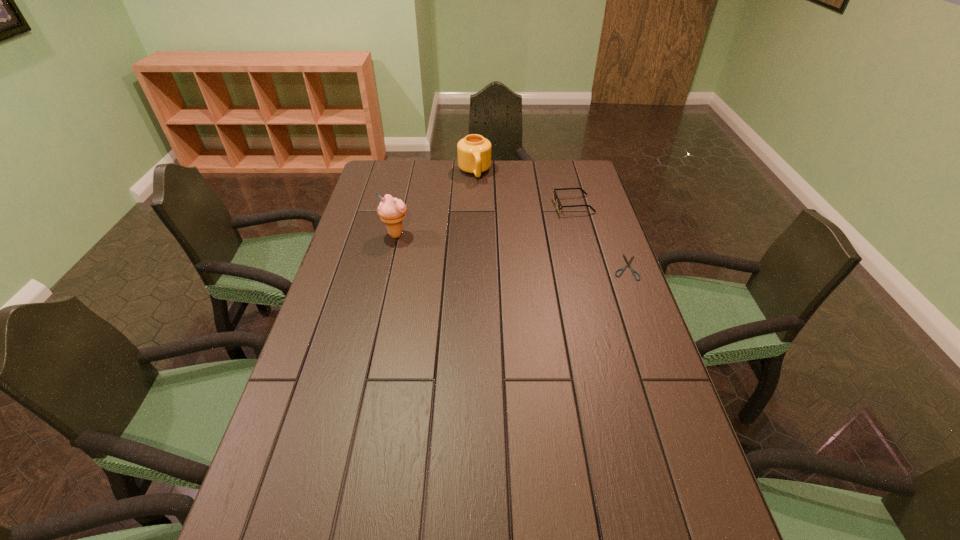
This screenshot has width=960, height=540. I want to click on free space between the second shortest object and the leftmost object, so click(485, 220).

The width and height of the screenshot is (960, 540). Find the location of `free area in between the third object from right to left and the shears`. free area in between the third object from right to left and the shears is located at coordinates point(550,220).

Where is `vacant space that's between the third object from right to left and the sunglasses`? Image resolution: width=960 pixels, height=540 pixels. vacant space that's between the third object from right to left and the sunglasses is located at coordinates pos(524,189).

You are a GUI agent. You are given a task and a screenshot of the screen. Output one action in this format:
    pyautogui.click(x=<x>, y=<y>)
    Task: Click on the free space that is in between the sunglasses and the icecream
    
    Given the screenshot: What is the action you would take?
    pyautogui.click(x=485, y=220)

Image resolution: width=960 pixels, height=540 pixels. In order to click on empty space that is in between the third nearest object and the third farthest object in this screenshot , I will do (x=485, y=220).

I want to click on free space between the third farthest object and the third nearest object, so click(x=485, y=220).

At what (x,y) coordinates should I click in order to perform the action: click on object that ranks as the second closest to the third object from right to left. Please return your answer as a coordinate pair (x, y). The image size is (960, 540). Looking at the image, I should click on (391, 210).

This screenshot has width=960, height=540. I want to click on object that is the closest one to the second nearest object, so click(x=474, y=151).

At what (x,y) coordinates should I click in order to perform the action: click on free space that satisfies the following two spatial constraints: 1. on the back side of the second object from left to right; 2. on the left side of the icecream. Please return your answer as a coordinate pair (x, y). The image size is (960, 540). Looking at the image, I should click on (410, 172).

Locate an element on the screen. The height and width of the screenshot is (540, 960). vacant space that satisfies the following two spatial constraints: 1. on the front side of the second shortest object; 2. on the right side of the third shortest object is located at coordinates (474, 205).